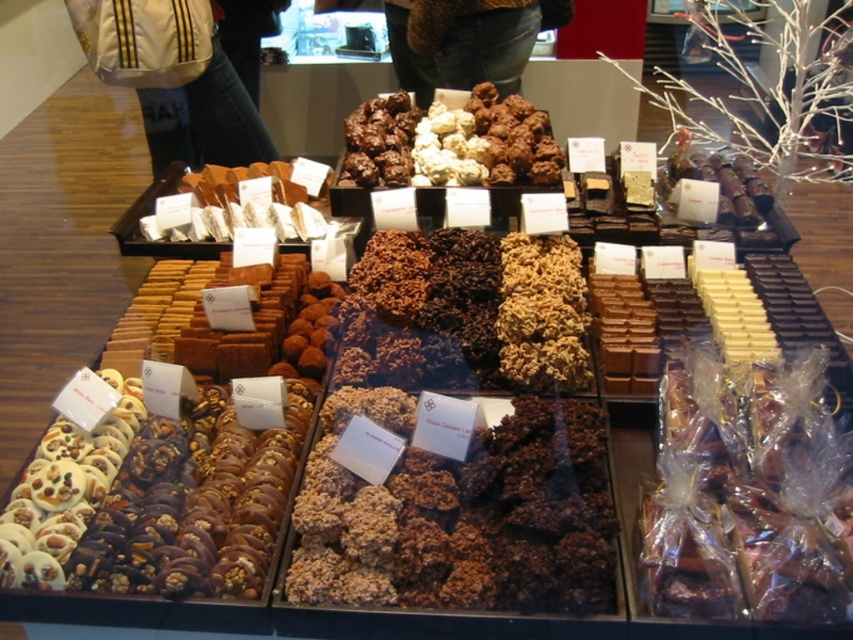
Which of these two, translucent plastic wrapped chocolates at lower right or white fabric bag at upper left, stands taller?

With more height is white fabric bag at upper left.

Which is behind, point (822, 577) or point (213, 86)?

Point (213, 86)

Identify the location of translucent plastic wrapped chocolates at lower right. (749, 493).

Can you confirm if chocolate crumbly at center is wider than translucent plastic wrapped chocolates at lower right?

Indeed, chocolate crumbly at center has a greater width compared to translucent plastic wrapped chocolates at lower right.

Is chocolate crumbly at center taller than translucent plastic wrapped chocolates at lower right?

Incorrect, chocolate crumbly at center's height is not larger of translucent plastic wrapped chocolates at lower right's.

Is point (302, 588) positioned before point (677, 609)?

No, (302, 588) is further to viewer.

Where is `chocolate crumbly at center`? The height and width of the screenshot is (640, 853). chocolate crumbly at center is located at coordinates (460, 515).

Which is behind, point (291, 563) or point (228, 211)?

Positioned behind is point (228, 211).

Between chocolate crumbly at center and white chocolate bar at center, which one has more height?

chocolate crumbly at center is taller.

You are a GUI agent. You are given a task and a screenshot of the screen. Output one action in this format:
    pyautogui.click(x=<x>, y=<y>)
    Task: Click on the chocolate crumbly at center
    
    Given the screenshot: What is the action you would take?
    pyautogui.click(x=460, y=515)

Locate an element on the screen. chocolate crumbly at center is located at coordinates (460, 515).